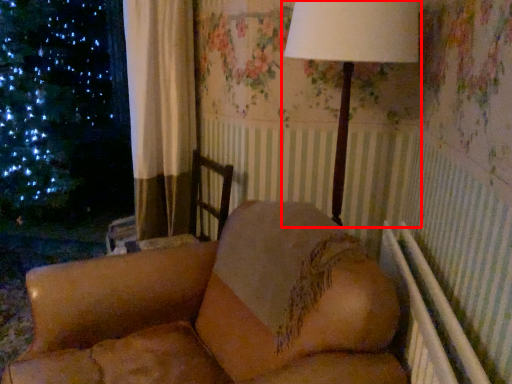
Question: From the image's perspective, where is lamp (annotated by the red box) located relative to furniture?

Choices:
 (A) below
 (B) above

Answer: (B)